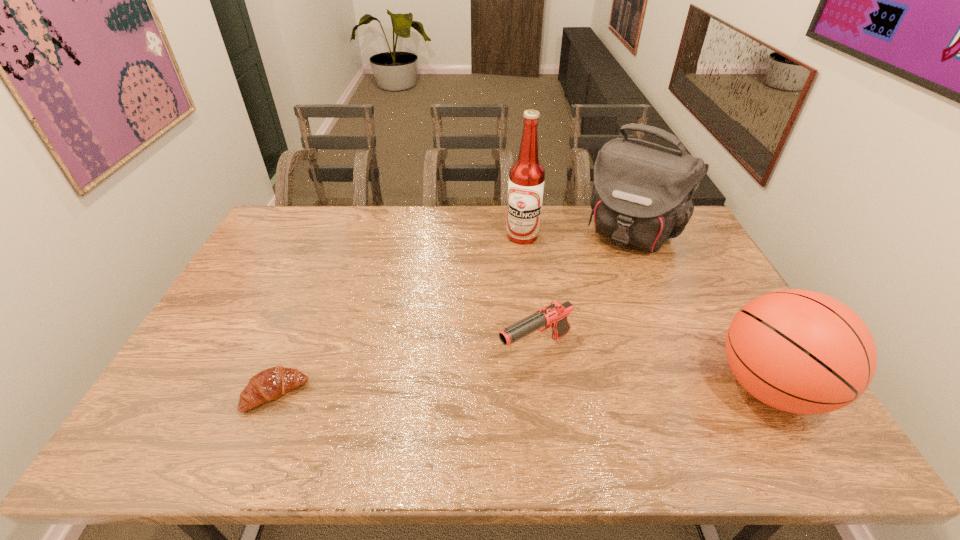
Locate an element on the screen. Image resolution: width=960 pixels, height=540 pixels. free space on the desktop that is between the crescent roll and the basketball and is positioned at the aiming end of the fourth tallest object is located at coordinates (461, 392).

Locate an element on the screen. Image resolution: width=960 pixels, height=540 pixels. vacant spot on the desktop that is between the shortest object and the third shortest object and is positioned on the label side of the alcohol is located at coordinates (545, 390).

Where is `free space on the desktop that is between the shortest object and the basketball and is positioned on the open flap of the second tallest object`? The image size is (960, 540). free space on the desktop that is between the shortest object and the basketball and is positioned on the open flap of the second tallest object is located at coordinates (523, 390).